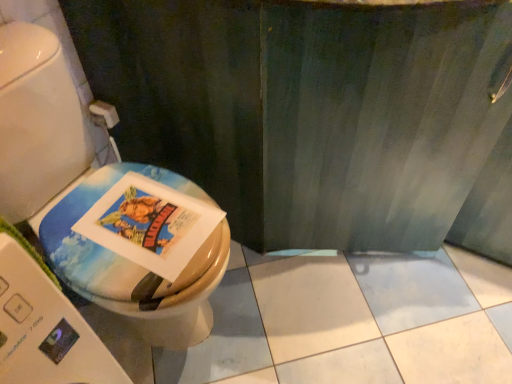
At what (x,y) coordinates should I click in order to perform the action: click on matte plastic toilet at left. Please return your answer as a coordinate pair (x, y). Looking at the image, I should click on (103, 203).

I want to click on white matte toilet paper at upper left, so click(x=105, y=112).

This screenshot has height=384, width=512. What do you see at coordinates (105, 112) in the screenshot?
I see `white matte toilet paper at upper left` at bounding box center [105, 112].

Where is `matte plastic toilet at left`? This screenshot has height=384, width=512. matte plastic toilet at left is located at coordinates (103, 203).

Looking at this image, can you confirm if matte plastic toilet at left is taller than white matte toilet paper at upper left?

Indeed, matte plastic toilet at left has a greater height compared to white matte toilet paper at upper left.

Is matte plastic toilet at left behind white matte toilet paper at upper left?

No, it is in front of white matte toilet paper at upper left.

Can you tell me how much matte plastic toilet at left and white matte toilet paper at upper left differ in facing direction?

The facing directions of matte plastic toilet at left and white matte toilet paper at upper left are 3.38 degrees apart.

Considering the relative sizes of white matte toilet paper at upper left and matte plastic toilet at left in the image provided, is white matte toilet paper at upper left bigger than matte plastic toilet at left?

No.

Between white matte toilet paper at upper left and matte plastic toilet at left, which one appears on the left side from the viewer's perspective?

white matte toilet paper at upper left is more to the left.

Identify the location of toilet on the right of white matte toilet paper at upper left. (103, 203).

Could matte plastic toilet at left be considered to be inside white matte toilet paper at upper left?

That's incorrect, matte plastic toilet at left is not inside white matte toilet paper at upper left.

Is matte plastic toilet at left at the back of matte paper comic book at center?

Absolutely, matte paper comic book at center is directed away from matte plastic toilet at left.

In the scene shown: Are matte paper comic book at center and matte plastic toilet at left beside each other?

Yes, matte paper comic book at center is with matte plastic toilet at left.

Could matte plastic toilet at left be considered to be inside matte paper comic book at center?

That's incorrect, matte plastic toilet at left is not inside matte paper comic book at center.

Considering the relative positions of matte paper comic book at center and matte plastic toilet at left in the image provided, is matte paper comic book at center behind matte plastic toilet at left?

Yes, it is behind matte plastic toilet at left.

From the image's perspective, is matte paper comic book at center beneath white matte toilet paper at upper left?

Yes, from the image's perspective, matte paper comic book at center is beneath white matte toilet paper at upper left.

Does matte paper comic book at center have a lesser height compared to white matte toilet paper at upper left?

Yes, matte paper comic book at center is shorter than white matte toilet paper at upper left.

Is matte paper comic book at center oriented towards white matte toilet paper at upper left?

No, matte paper comic book at center is not aimed at white matte toilet paper at upper left.

Can you tell me how much matte plastic toilet at left and matte paper comic book at center differ in facing direction?

1.16 degrees.

In the scene shown: Considering the sizes of objects matte plastic toilet at left and matte paper comic book at center in the image provided, who is smaller, matte plastic toilet at left or matte paper comic book at center?

matte paper comic book at center is smaller.

From the image's perspective, is matte plastic toilet at left located beneath matte paper comic book at center?

No.

In order to click on toilet directly beneath the matte paper comic book at center (from a real-world perspective) in this screenshot , I will do `click(103, 203)`.

Can you confirm if white matte toilet paper at upper left is wider than matte paper comic book at center?

No, white matte toilet paper at upper left is not wider than matte paper comic book at center.

From the image's perspective, which one is positioned lower, white matte toilet paper at upper left or matte paper comic book at center?

matte paper comic book at center is shown below in the image.

Is white matte toilet paper at upper left turned away from matte paper comic book at center?

That's not correct — white matte toilet paper at upper left is not looking away from matte paper comic book at center.

Is the position of white matte toilet paper at upper left less distant than that of matte paper comic book at center?

No, white matte toilet paper at upper left is behind matte paper comic book at center.

The image size is (512, 384). What are the coordinates of `toilet that appears below the white matte toilet paper at upper left (from the image's perspective)` in the screenshot? It's located at (103, 203).

Image resolution: width=512 pixels, height=384 pixels. I want to click on toilet paper located underneath the matte plastic toilet at left (from a real-world perspective), so click(105, 112).

Which object lies further to the anchor point matte plastic toilet at left, matte paper comic book at center or white matte toilet paper at upper left?

white matte toilet paper at upper left lies further to matte plastic toilet at left than the other object.

Which object lies nearer to the anchor point white matte toilet paper at upper left, matte paper comic book at center or matte plastic toilet at left?

matte plastic toilet at left.

In the scene shown: Considering their positions, is matte plastic toilet at left positioned further to matte paper comic book at center than white matte toilet paper at upper left?

white matte toilet paper at upper left is further to matte paper comic book at center.

In the scene shown: Looking at the image, which one is located further to matte paper comic book at center, white matte toilet paper at upper left or matte plastic toilet at left?

Among the two, white matte toilet paper at upper left is located further to matte paper comic book at center.

Based on their spatial positions, is white matte toilet paper at upper left or matte paper comic book at center closer to matte plastic toilet at left?

matte paper comic book at center.

Estimate the real-world distances between objects in this image. Which object is further from white matte toilet paper at upper left, matte plastic toilet at left or matte paper comic book at center?

matte paper comic book at center.

At what (x,y) coordinates should I click in order to perform the action: click on comic book between matte plastic toilet at left and white matte toilet paper at upper left along the z-axis. Please return your answer as a coordinate pair (x, y). Looking at the image, I should click on (150, 224).